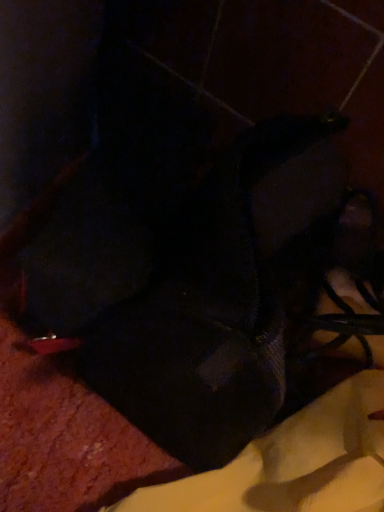
At what (x,y) coordinates should I click in order to perform the action: click on white soft fabric at center. Please return your answer as a coordinate pair (x, y). Image resolution: width=384 pixels, height=512 pixels. Looking at the image, I should click on (293, 463).

Describe the element at coordinates (293, 463) in the screenshot. The width and height of the screenshot is (384, 512). I see `white soft fabric at center` at that location.

At what (x,y) coordinates should I click in order to perform the action: click on white soft fabric at center. Please return your answer as a coordinate pair (x, y). Looking at the image, I should click on (293, 463).